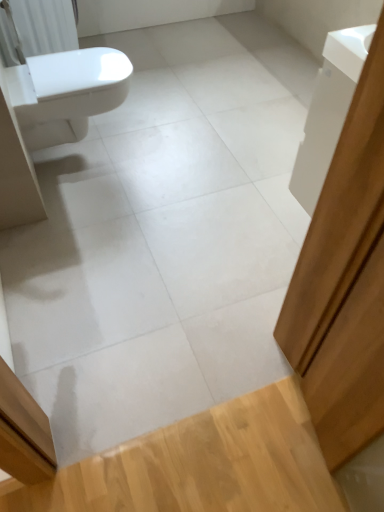
Question: Considering the relative sizes of white plastic radiator at upper left and white glossy bidet at left in the image provided, is white plastic radiator at upper left shorter than white glossy bidet at left?

Choices:
 (A) no
 (B) yes

Answer: (A)

Question: Does white plastic radiator at upper left have a greater height compared to white glossy bidet at left?

Choices:
 (A) yes
 (B) no

Answer: (A)

Question: Considering the relative sizes of white plastic radiator at upper left and white glossy bidet at left in the image provided, is white plastic radiator at upper left smaller than white glossy bidet at left?

Choices:
 (A) yes
 (B) no

Answer: (B)

Question: Are white plastic radiator at upper left and white glossy bidet at left making contact?

Choices:
 (A) yes
 (B) no

Answer: (B)

Question: From the image's perspective, is white plastic radiator at upper left beneath white glossy bidet at left?

Choices:
 (A) no
 (B) yes

Answer: (A)

Question: From the image's perspective, relative to white plastic radiator at upper left, is white glossy bidet at left above or below?

Choices:
 (A) above
 (B) below

Answer: (B)

Question: From a real-world perspective, is white glossy bidet at left physically located above or below white plastic radiator at upper left?

Choices:
 (A) below
 (B) above

Answer: (A)

Question: Looking at the image, does white glossy bidet at left seem bigger or smaller compared to white plastic radiator at upper left?

Choices:
 (A) small
 (B) big

Answer: (A)

Question: Is point (74, 94) positioned closer to the camera than point (69, 16)?

Choices:
 (A) farther
 (B) closer

Answer: (B)

Question: Is white plastic radiator at upper left to the left or to the right of white glossy bidet at left in the image?

Choices:
 (A) left
 (B) right

Answer: (A)

Question: Looking at the image, does white plastic radiator at upper left seem bigger or smaller compared to white glossy bidet at left?

Choices:
 (A) big
 (B) small

Answer: (A)

Question: Considering the positions of point (69, 44) and point (51, 57), is point (69, 44) closer or farther from the camera than point (51, 57)?

Choices:
 (A) farther
 (B) closer

Answer: (A)

Question: In terms of width, does white plastic radiator at upper left look wider or thinner when compared to white glossy bidet at left?

Choices:
 (A) wide
 (B) thin

Answer: (B)

Question: From the image's perspective, is white glossy cabinet at upper right located above or below white glossy bidet at left?

Choices:
 (A) below
 (B) above

Answer: (A)

Question: Considering the positions of white glossy cabinet at upper right and white glossy bidet at left in the image, is white glossy cabinet at upper right wider or thinner than white glossy bidet at left?

Choices:
 (A) thin
 (B) wide

Answer: (A)